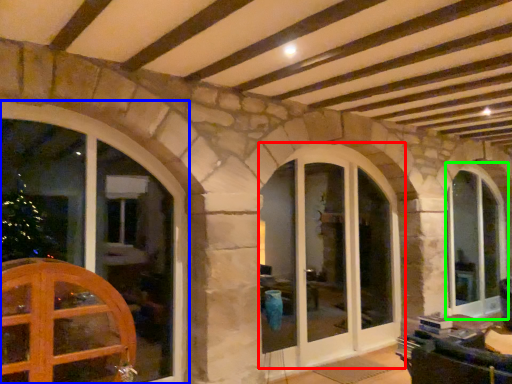
Question: Estimate the real-world distances between objects in this image. Which object is farther from window (highlighted by a red box), window (highlighted by a blue box) or window (highlighted by a green box)?

Choices:
 (A) window
 (B) window

Answer: (A)